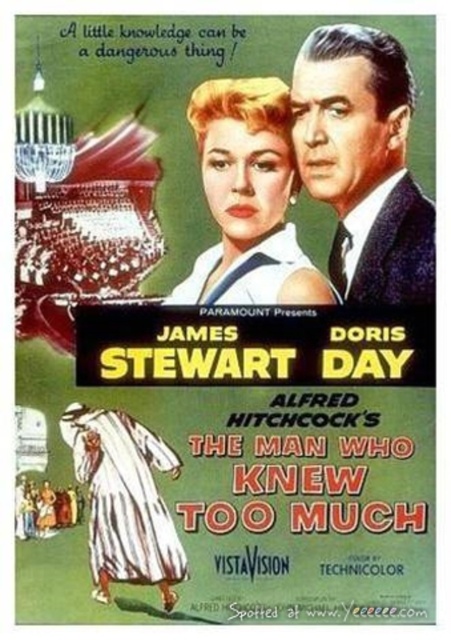
Looking at the vintage movie poster for Alfred Hitchcock, you notice the smooth black suit at upper right and the matte blonde hair at center. Which of these two elements appears bigger in size?

The smooth black suit at upper right has a larger size compared to the matte blonde hair at center.

From the picture: Looking at the vintage movie poster for Alfred Hitchcock, you notice the smooth black suit at upper right and the matte blonde hair at center. Which object is placed higher on the poster?

The smooth black suit at upper right is positioned over matte blonde hair at center, so it is higher on the poster.

Looking at the vintage movie poster for Alfred Hitchcock, you notice the smooth black suit at upper right and the matte blonde hair at center. Which object appears narrower in the image?

The smooth black suit at upper right is narrower than the matte blonde hair at center.